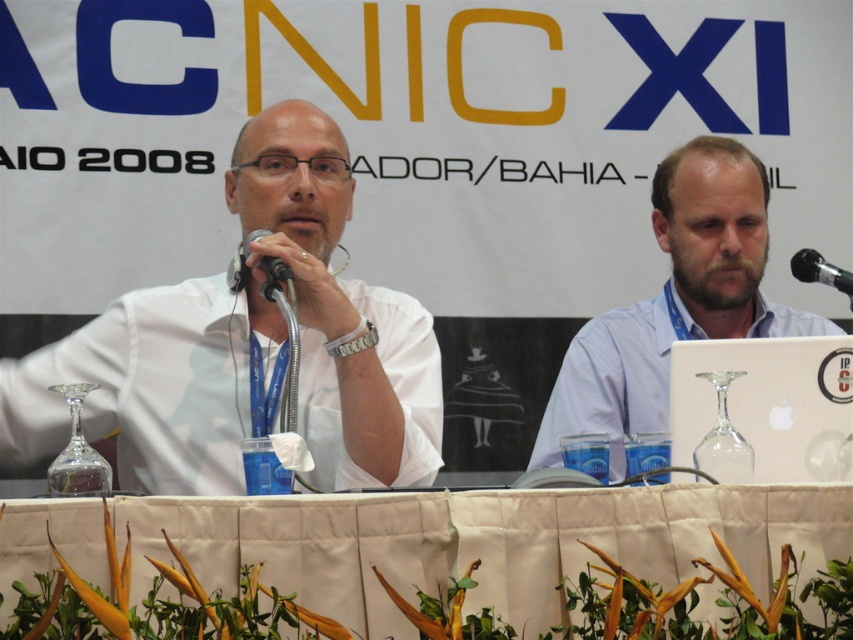
Question: Does white fabric table at center appear on the left side of white matte shirt at left?

Choices:
 (A) no
 (B) yes

Answer: (A)

Question: Is white fabric table at center positioned at the back of black metallic microphone at center?

Choices:
 (A) no
 (B) yes

Answer: (A)

Question: Which object is closer to the camera taking this photo?

Choices:
 (A) black metallic microphone at center
 (B) white fabric table at center

Answer: (B)

Question: Which object is positioned farthest from the light blue shirt at right?

Choices:
 (A) white fabric table at center
 (B) white matte shirt at left

Answer: (A)

Question: Where is white fabric table at center located in relation to black metallic microphone at center in the image?

Choices:
 (A) left
 (B) right

Answer: (B)

Question: Among these points, which one is farthest from the camera?

Choices:
 (A) (376, 611)
 (B) (273, 275)
 (C) (848, 275)

Answer: (C)